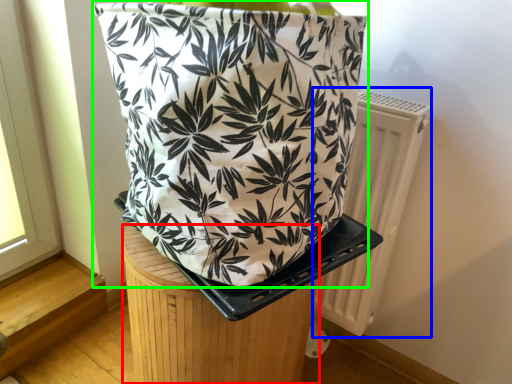
Question: Which object is positioned closest to furniture (highlighted by a red box)? Select from radiator (highlighted by a blue box) and handbag (highlighted by a green box).

Choices:
 (A) radiator
 (B) handbag

Answer: (B)